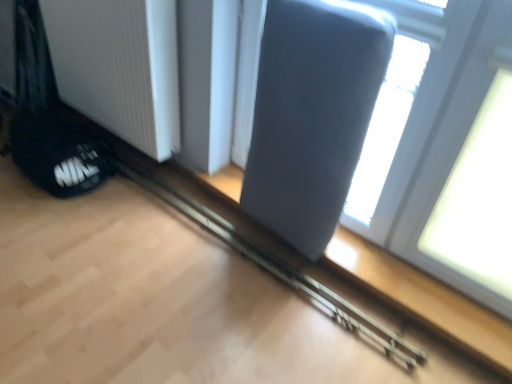
Locate an element on the screen. The height and width of the screenshot is (384, 512). empty space that is to the right of black mesh shoe at lower left is located at coordinates (119, 200).